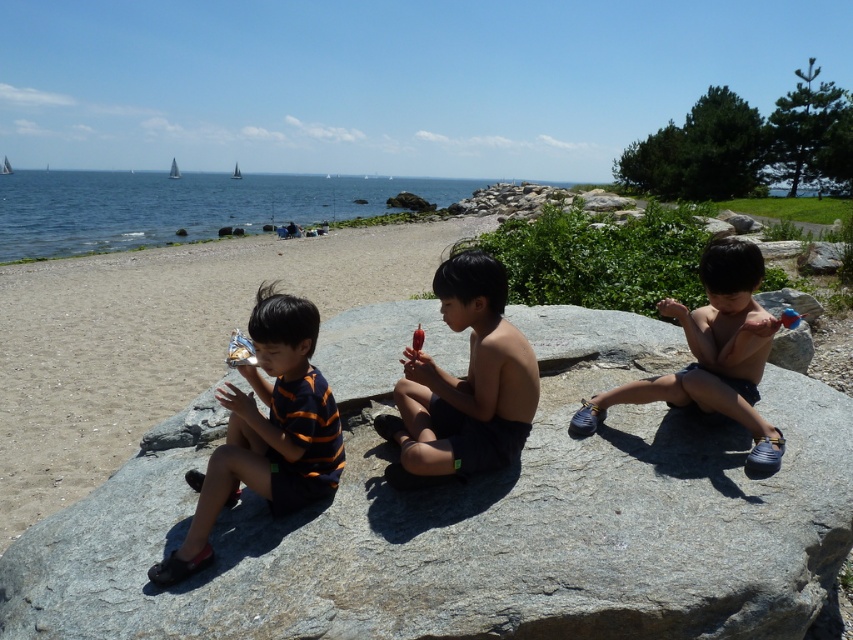
Does point (479, 401) come behind point (724, 294)?

That is False.

Is the position of smooth skin boy at center more distant than that of nude skin child at center?

No, it is in front of nude skin child at center.

Is point (428, 451) positioned before point (733, 257)?

Yes, point (428, 451) is in front of point (733, 257).

You are a GUI agent. You are given a task and a screenshot of the screen. Output one action in this format:
    pyautogui.click(x=<x>, y=<y>)
    Task: Click on the smooth skin boy at center
    Image resolution: width=853 pixels, height=640 pixels.
    Given the screenshot: What is the action you would take?
    pyautogui.click(x=463, y=385)

You are a GUI agent. You are given a task and a screenshot of the screen. Output one action in this format:
    pyautogui.click(x=<x>, y=<y>)
    Task: Click on the gray rough rock at center
    
    Given the screenshot: What is the action you would take?
    point(471,513)

Who is lower down, gray rough rock at center or nude skin child at center?

Positioned lower is gray rough rock at center.

Who is more distant from viewer, (775, 568) or (750, 376)?

Point (750, 376)

Find the location of `gray rough rock at center`. gray rough rock at center is located at coordinates (471, 513).

Is orange striped shirt at left shorter than smooth skin boy at center?

Incorrect, orange striped shirt at left's height does not fall short of smooth skin boy at center's.

Based on the photo, between orange striped shirt at left and smooth skin boy at center, which one is positioned lower?

orange striped shirt at left is below.

The image size is (853, 640). What are the coordinates of `orange striped shirt at left` in the screenshot? It's located at (265, 432).

Locate an element on the screen. orange striped shirt at left is located at coordinates (265, 432).